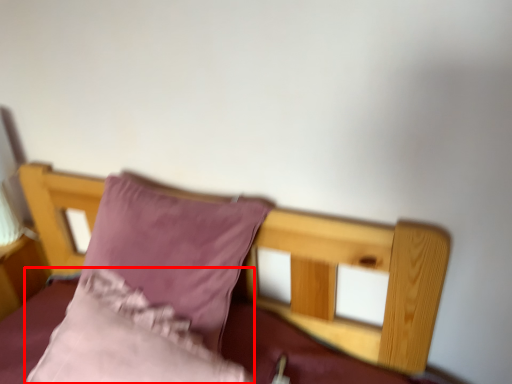
Question: Observing the image, what is the correct spatial positioning of pillow (annotated by the red box) in reference to pillow?

Choices:
 (A) right
 (B) left

Answer: (B)